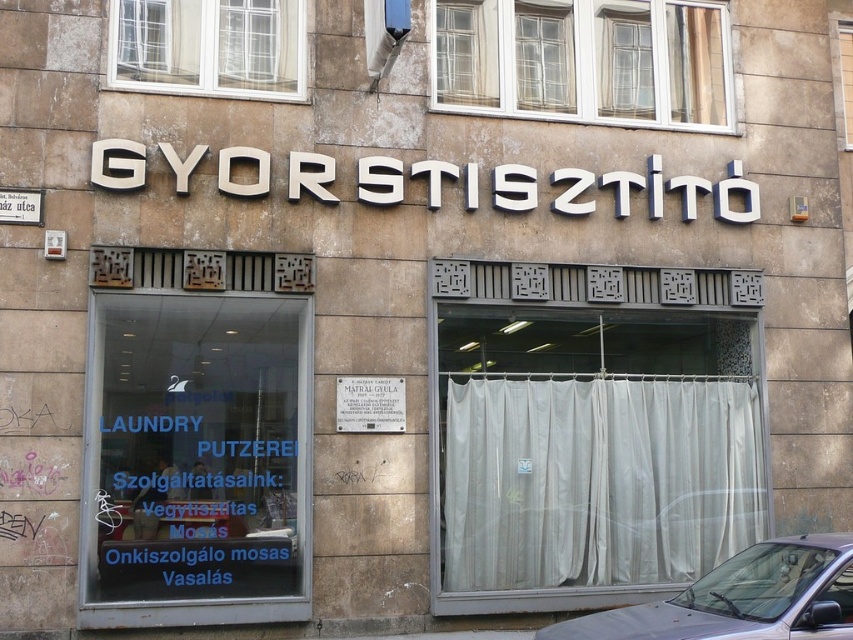
Between white plastic window at upper center and white glass window at upper left, which one appears on the right side from the viewer's perspective?

Positioned to the right is white plastic window at upper center.

Is white plastic window at upper center to the right of white glass window at upper left from the viewer's perspective?

Indeed, white plastic window at upper center is positioned on the right side of white glass window at upper left.

Who is more distant from viewer, (608,33) or (192,65)?

Positioned behind is point (608,33).

The image size is (853, 640). What are the coordinates of `white plastic window at upper center` in the screenshot? It's located at (584, 60).

Is white fabric curtain at right to the right of white plastic window at upper center from the viewer's perspective?

Yes, white fabric curtain at right is to the right of white plastic window at upper center.

Is point (460, 467) positioned after point (567, 67)?

No, it is in front of (567, 67).

Locate an element on the screen. The image size is (853, 640). white fabric curtain at right is located at coordinates (596, 481).

Between white fabric curtain at right and gray metallic car at lower right, which one is positioned lower?

gray metallic car at lower right is lower down.

You are a GUI agent. You are given a task and a screenshot of the screen. Output one action in this format:
    pyautogui.click(x=<x>, y=<y>)
    Task: Click on the white fabric curtain at right
    
    Given the screenshot: What is the action you would take?
    pyautogui.click(x=596, y=481)

Find the location of `white fabric curtain at right`. white fabric curtain at right is located at coordinates (596, 481).